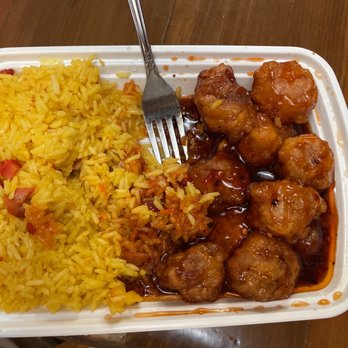
Find the location of a particular element. This screenshot has width=348, height=348. table top is located at coordinates (237, 21).